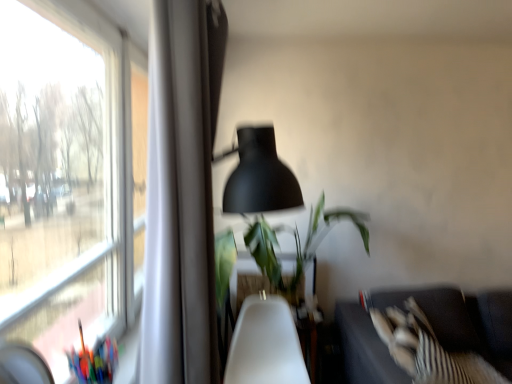
Question: Is white plastic swivel chair at center completely or partially inside matte black lampshade at center?

Choices:
 (A) no
 (B) yes

Answer: (A)

Question: Considering the relative positions of matte black lampshade at center and white plastic swivel chair at center in the image provided, is matte black lampshade at center to the right of white plastic swivel chair at center from the viewer's perspective?

Choices:
 (A) yes
 (B) no

Answer: (B)

Question: Does matte black lampshade at center lie in front of white plastic swivel chair at center?

Choices:
 (A) yes
 (B) no

Answer: (A)

Question: Is matte black lampshade at center positioned behind white plastic swivel chair at center?

Choices:
 (A) no
 (B) yes

Answer: (A)

Question: Does matte black lampshade at center have a lesser height compared to white plastic swivel chair at center?

Choices:
 (A) yes
 (B) no

Answer: (B)

Question: Is white plastic swivel chair at center in front of or behind matte black lampshade at center in the image?

Choices:
 (A) front
 (B) behind

Answer: (B)

Question: Based on their sizes in the image, would you say white plastic swivel chair at center is bigger or smaller than matte black lampshade at center?

Choices:
 (A) small
 (B) big

Answer: (A)

Question: From a real-world perspective, is white plastic swivel chair at center physically located above or below matte black lampshade at center?

Choices:
 (A) above
 (B) below

Answer: (B)

Question: Considering the positions of white plastic swivel chair at center and matte black lampshade at center in the image, is white plastic swivel chair at center wider or thinner than matte black lampshade at center?

Choices:
 (A) thin
 (B) wide

Answer: (B)

Question: From a real-world perspective, relative to green leafy plant at center, is white plastic swivel chair at center vertically above or below?

Choices:
 (A) below
 (B) above

Answer: (A)

Question: Looking at the image, does white plastic swivel chair at center seem bigger or smaller compared to green leafy plant at center?

Choices:
 (A) small
 (B) big

Answer: (A)

Question: Relative to green leafy plant at center, is white plastic swivel chair at center in front or behind?

Choices:
 (A) behind
 (B) front

Answer: (B)

Question: From the image's perspective, is white plastic swivel chair at center above or below green leafy plant at center?

Choices:
 (A) below
 (B) above

Answer: (A)

Question: Relative to white plastic swivel chair at center, is green leafy plant at center in front or behind?

Choices:
 (A) front
 (B) behind

Answer: (B)

Question: From a real-world perspective, is green leafy plant at center above or below white plastic swivel chair at center?

Choices:
 (A) below
 (B) above

Answer: (B)